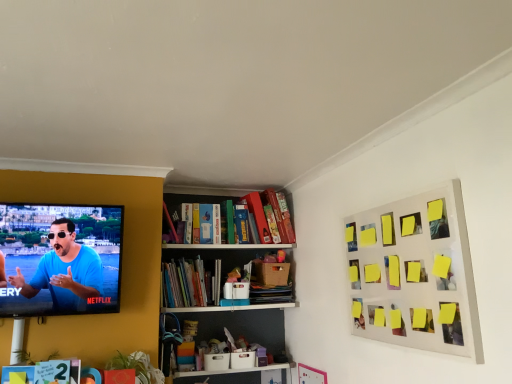
Question: In the image, is yellow sticky notes at upper right on the left side or the right side of hardcover book at lower left, the first book in the front-to-back sequence?

Choices:
 (A) right
 (B) left

Answer: (A)

Question: Is point (358, 332) closer or farther from the camera than point (52, 372)?

Choices:
 (A) closer
 (B) farther

Answer: (B)

Question: Based on their relative distances, which object is nearer to the hardcover book at lower left, which is the first book in bottom-to-top order?

Choices:
 (A) yellow sticky notes at upper right
 (B) hardcover books at center, the 1th book in the top-to-bottom sequence
 (C) matte blue shirt at left

Answer: (C)

Question: Which is farther from the hardcover book at lower left, the first book in the front-to-back sequence?

Choices:
 (A) matte blue shirt at left
 (B) hardcover books at center, the second book in the left-to-right sequence
 (C) yellow sticky notes at upper right

Answer: (C)